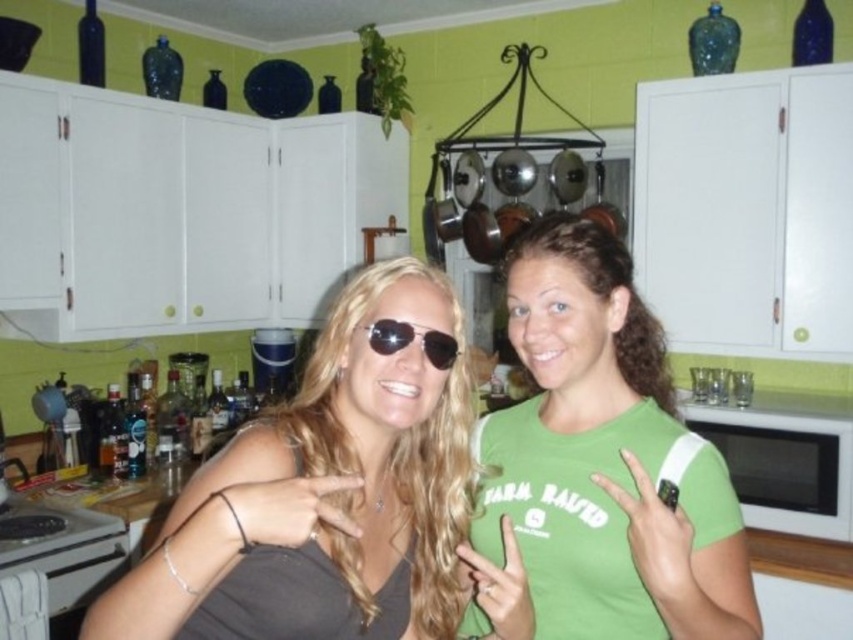
Can you confirm if green cotton shirt at center is positioned below sunglasses at center?

Correct, green cotton shirt at center is located below sunglasses at center.

Which is more to the left, green cotton shirt at center or sunglasses at center?

From the viewer's perspective, sunglasses at center appears more on the left side.

Where is `green cotton shirt at center`? Image resolution: width=853 pixels, height=640 pixels. green cotton shirt at center is located at coordinates (602, 458).

Locate an element on the screen. Image resolution: width=853 pixels, height=640 pixels. green cotton shirt at center is located at coordinates (602, 458).

Who is lower down, green cotton shirt at center or white matte microwave at right?

Positioned lower is white matte microwave at right.

The width and height of the screenshot is (853, 640). Identify the location of green cotton shirt at center. (602, 458).

Is point (637, 634) behind point (712, 433)?

No.

Find the location of `green cotton shirt at center`. green cotton shirt at center is located at coordinates (602, 458).

How much distance is there between matte gray tank top at center and green cotton shirt at center?

The distance of matte gray tank top at center from green cotton shirt at center is 9.03 inches.

Can you confirm if matte gray tank top at center is bigger than green cotton shirt at center?

Actually, matte gray tank top at center might be smaller than green cotton shirt at center.

Who is more distant from viewer, (451,314) or (590,467)?

The point (590,467) is more distant.

You are a GUI agent. You are given a task and a screenshot of the screen. Output one action in this format:
    pyautogui.click(x=<x>, y=<y>)
    Task: Click on the matte gray tank top at center
    
    Given the screenshot: What is the action you would take?
    pyautogui.click(x=340, y=483)